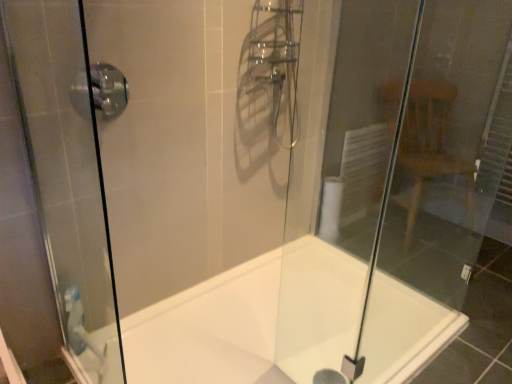
You are a GUI agent. You are given a task and a screenshot of the screen. Output one action in this format:
    pyautogui.click(x=<x>, y=<y>)
    Task: Click on the white glossy bathtub at center
    
    Given the screenshot: What is the action you would take?
    pyautogui.click(x=251, y=320)

Measure the distance between point (212, 345) and camera.

A distance of 5.46 feet exists between point (212, 345) and camera.

Find the location of a particular element. This screenshot has height=384, width=512. satin chrome shower handle at upper left is located at coordinates (108, 89).

Find the location of a particular element. The height and width of the screenshot is (384, 512). white glossy bathtub at center is located at coordinates (251, 320).

Between point (87, 97) and point (466, 259), which one is positioned in front?

The point (87, 97) is more forward.

Are satin chrome shower handle at upper left and transparent glass door at right making contact?

No, satin chrome shower handle at upper left is not with transparent glass door at right.

From a real-world perspective, is satin chrome shower handle at upper left on transparent glass door at right?

Indeed, from a real-world perspective, satin chrome shower handle at upper left stands above transparent glass door at right.

From the image's perspective, between satin chrome shower handle at upper left and transparent glass door at right, who is located below?

transparent glass door at right appears lower in the image.

From a real-world perspective, between transparent glass door at right and white glossy bathtub at center, who is vertically higher?

transparent glass door at right is physically above.

Consider the image. Considering the relative sizes of transparent glass door at right and white glossy bathtub at center in the image provided, is transparent glass door at right taller than white glossy bathtub at center?

Yes, transparent glass door at right is taller than white glossy bathtub at center.

Considering the relative positions of transparent glass door at right and white glossy bathtub at center in the image provided, is transparent glass door at right to the left or to the right of white glossy bathtub at center?

In the image, transparent glass door at right appears on the right side of white glossy bathtub at center.

Relative to satin chrome shower handle at upper left, is white glossy bathtub at center in front or behind?

Result: Clearly, white glossy bathtub at center is in front of satin chrome shower handle at upper left.

In the scene shown: From a real-world perspective, is white glossy bathtub at center physically above satin chrome shower handle at upper left?

No.

Is white glossy bathtub at center facing away from satin chrome shower handle at upper left?

No, white glossy bathtub at center is not facing away from satin chrome shower handle at upper left.

Is white glossy bathtub at center directly adjacent to satin chrome shower handle at upper left?

white glossy bathtub at center and satin chrome shower handle at upper left are not in contact.

Considering the sizes of objects white glossy bathtub at center and transparent glass shower door at left in the image provided, who is smaller, white glossy bathtub at center or transparent glass shower door at left?

Smaller between the two is transparent glass shower door at left.

The height and width of the screenshot is (384, 512). In order to click on bathtub below the transparent glass shower door at left (from the image's perspective) in this screenshot , I will do `click(251, 320)`.

From the image's perspective, which is above, white glossy bathtub at center or transparent glass shower door at left?

transparent glass shower door at left, from the image's perspective.

Between point (160, 357) and point (61, 2), which one is positioned behind?

The point (160, 357) is behind.

Is there a large distance between transparent glass shower door at left and satin chrome shower handle at upper left?

No, transparent glass shower door at left is not far from satin chrome shower handle at upper left.

Does transparent glass shower door at left lie in front of satin chrome shower handle at upper left?

Yes, transparent glass shower door at left is in front of satin chrome shower handle at upper left.

Locate an element on the screen. The image size is (512, 384). shower on the right of the transparent glass shower door at left is located at coordinates (x=108, y=89).

What's the angular difference between transparent glass shower door at left and satin chrome shower handle at upper left's facing directions?

91 degrees separate the facing orientations of transparent glass shower door at left and satin chrome shower handle at upper left.

From the image's perspective, which is below, transparent glass door at right or satin chrome shower handle at upper left?

transparent glass door at right.

In the scene shown: Considering the positions of objects transparent glass door at right and satin chrome shower handle at upper left in the image provided, who is behind, transparent glass door at right or satin chrome shower handle at upper left?

Positioned behind is transparent glass door at right.

Which is closer, (490, 1) or (110, 85)?

Positioned in front is point (110, 85).

Is transparent glass door at right wider or thinner than satin chrome shower handle at upper left?

transparent glass door at right is thinner than satin chrome shower handle at upper left.

Can you confirm if white glossy bathtub at center is wider than transparent glass door at right?

Correct, the width of white glossy bathtub at center exceeds that of transparent glass door at right.

Is white glossy bathtub at center positioned with its back to transparent glass door at right?

No, transparent glass door at right is not at the back of white glossy bathtub at center.

From the image's perspective, which one is positioned lower, white glossy bathtub at center or transparent glass door at right?

white glossy bathtub at center, from the image's perspective.

In the image, there is a transparent glass door at right. Where is `shower above it (from the image's perspective)`? The width and height of the screenshot is (512, 384). shower above it (from the image's perspective) is located at coordinates (108, 89).

This screenshot has height=384, width=512. I want to click on bathtub below the transparent glass door at right (from a real-world perspective), so click(x=251, y=320).

Considering their positions, is satin chrome shower handle at upper left positioned closer to transparent glass shower door at left than white glossy bathtub at center?

The object closer to transparent glass shower door at left is satin chrome shower handle at upper left.

When comparing their distances from transparent glass shower door at left, does transparent glass door at right or satin chrome shower handle at upper left seem closer?

Based on the image, satin chrome shower handle at upper left appears to be nearer to transparent glass shower door at left.

Estimate the real-world distances between objects in this image. Which object is further from white glossy bathtub at center, transparent glass door at right or transparent glass shower door at left?

Among the two, transparent glass shower door at left is located further to white glossy bathtub at center.

When comparing their distances from transparent glass door at right, does transparent glass shower door at left or white glossy bathtub at center seem closer?

white glossy bathtub at center lies closer to transparent glass door at right than the other object.

When comparing their distances from transparent glass shower door at left, does white glossy bathtub at center or transparent glass door at right seem further?

The object further to transparent glass shower door at left is transparent glass door at right.

Based on their spatial positions, is satin chrome shower handle at upper left or white glossy bathtub at center closer to transparent glass door at right?

Based on the image, white glossy bathtub at center appears to be nearer to transparent glass door at right.

Based on their spatial positions, is transparent glass door at right or satin chrome shower handle at upper left closer to white glossy bathtub at center?

The object closer to white glossy bathtub at center is transparent glass door at right.

When comparing their distances from satin chrome shower handle at upper left, does transparent glass shower door at left or white glossy bathtub at center seem closer?

transparent glass shower door at left.

The image size is (512, 384). I want to click on bathtub located between transparent glass shower door at left and transparent glass door at right in the left-right direction, so click(251, 320).

You are a GUI agent. You are given a task and a screenshot of the screen. Output one action in this format:
    pyautogui.click(x=<x>, y=<y>)
    Task: Click on the shower between transparent glass shower door at left and transparent glass door at right in the horizontal direction
    This screenshot has height=384, width=512.
    Given the screenshot: What is the action you would take?
    pyautogui.click(x=108, y=89)

Image resolution: width=512 pixels, height=384 pixels. Identify the location of bathtub between satin chrome shower handle at upper left and transparent glass door at right. (251, 320).

At what (x,y) coordinates should I click in order to perform the action: click on screen door that lies between satin chrome shower handle at upper left and white glossy bathtub at center from top to bottom. Please return your answer as a coordinate pair (x, y). Looking at the image, I should click on (68, 173).